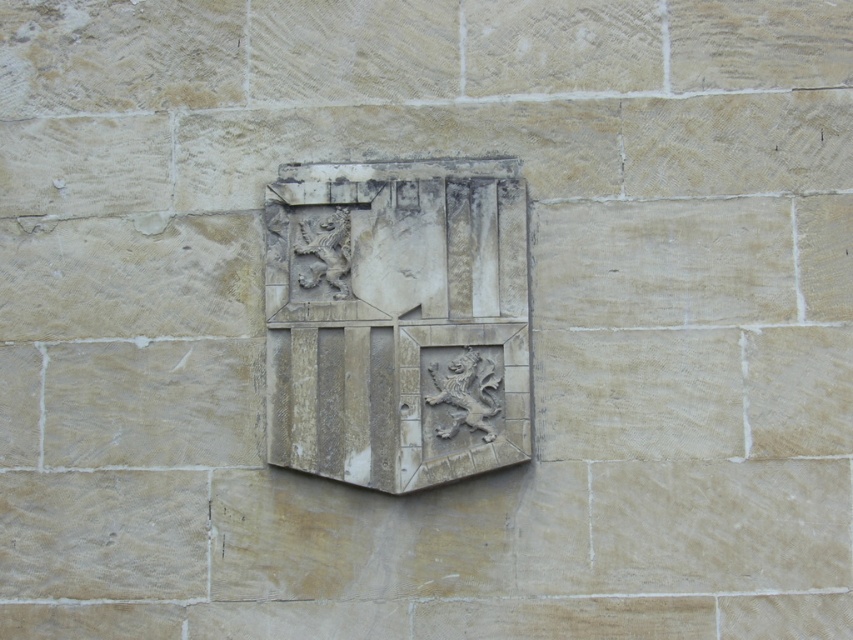
Question: Is stone relief emblem at center wider than carved stone lion at center?

Choices:
 (A) no
 (B) yes

Answer: (B)

Question: Which point appears farthest from the camera in this image?

Choices:
 (A) (390, 353)
 (B) (486, 369)

Answer: (A)

Question: Can you confirm if stone relief emblem at center is wider than carved stone lion at center?

Choices:
 (A) no
 (B) yes

Answer: (B)

Question: Considering the relative positions of stone relief emblem at center and carved stone lion at center in the image provided, where is stone relief emblem at center located with respect to carved stone lion at center?

Choices:
 (A) above
 (B) below

Answer: (A)

Question: Among these points, which one is farthest from the camera?

Choices:
 (A) (316, 230)
 (B) (489, 440)

Answer: (A)

Question: Among these objects, which one is nearest to the camera?

Choices:
 (A) stone relief emblem at center
 (B) carved stone lion at center

Answer: (A)